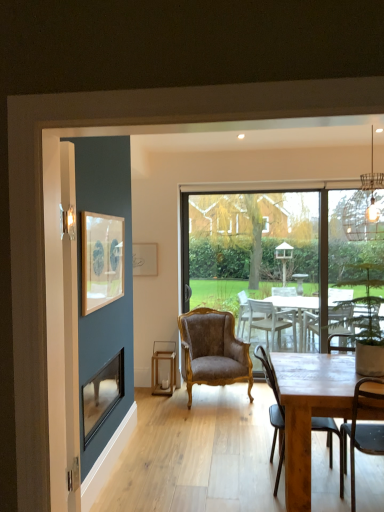
Describe the element at coordinates (212, 351) in the screenshot. The image size is (384, 512). I see `brown velvet armchair at center, which appears as the 1th chair when viewed from the back` at that location.

Image resolution: width=384 pixels, height=512 pixels. In order to click on matte white picture frame at upper center, acting as the 2th picture frame starting from the front in this screenshot , I will do `click(144, 259)`.

Looking at this image, is brown velvet armchair at center, the 3th chair from the front, spatially inside transparent glass window at center, or outside of it?

brown velvet armchair at center, the 3th chair from the front, is not enclosed by transparent glass window at center.

Considering the positions of objects brown velvet armchair at center, which appears as the 1th chair when viewed from the back, and transparent glass window at center in the image provided, who is more to the left, brown velvet armchair at center, which appears as the 1th chair when viewed from the back, or transparent glass window at center?

From the viewer's perspective, brown velvet armchair at center, which appears as the 1th chair when viewed from the back, appears more on the left side.

From the image's perspective, between brown velvet armchair at center, the 3th chair from the front, and transparent glass window at center, who is located below?

brown velvet armchair at center, the 3th chair from the front, appears lower in the image.

Does wooden chair at right, arranged as the 2th chair when viewed from the back, lie behind metallic black chair at lower right, the first chair when ordered from front to back?

That is True.

Does wooden chair at right, marked as the second chair in a front-to-back arrangement, turn towards metallic black chair at lower right, the first chair when ordered from front to back?

Yes, wooden chair at right, marked as the second chair in a front-to-back arrangement, is turned towards metallic black chair at lower right, the first chair when ordered from front to back.

Considering the positions of objects wooden chair at right, marked as the second chair in a front-to-back arrangement, and metallic black chair at lower right, the first chair when ordered from front to back, in the image provided, who is more to the right, wooden chair at right, marked as the second chair in a front-to-back arrangement, or metallic black chair at lower right, the first chair when ordered from front to back,?

Positioned to the right is metallic black chair at lower right, the first chair when ordered from front to back.

How many degrees apart are the facing directions of transparent glass window at center and metallic wire cage at upper right?

93.9 degrees.

I want to click on lamp that appears on the right of transparent glass window at center, so click(x=365, y=208).

From a real-world perspective, is transparent glass window at center positioned under metallic wire cage at upper right based on gravity?

Correct, in the physical world, transparent glass window at center is lower than metallic wire cage at upper right.

Considering the sizes of transparent glass window at center and metallic wire cage at upper right in the image, is transparent glass window at center bigger or smaller than metallic wire cage at upper right?

Considering their sizes, transparent glass window at center takes up more space than metallic wire cage at upper right.

From a real-world perspective, which object rests below the other?

metallic black chair at lower right, the first chair when ordered from front to back.

Who is bigger, metallic black chair at lower right, the 3th chair when ordered from back to front, or wooden framed artwork at upper left, acting as the first picture frame starting from the front?

metallic black chair at lower right, the 3th chair when ordered from back to front.

In the scene shown: Is metallic black chair at lower right, the first chair when ordered from front to back, to the left or to the right of wooden framed artwork at upper left, acting as the first picture frame starting from the front, in the image?

From the image, it's evident that metallic black chair at lower right, the first chair when ordered from front to back, is to the right of wooden framed artwork at upper left, acting as the first picture frame starting from the front.

Considering the sizes of objects wooden chair at right, arranged as the 2th chair when viewed from the back, and matte white picture frame at upper center, which appears as the first picture frame when viewed from the back, in the image provided, who is smaller, wooden chair at right, arranged as the 2th chair when viewed from the back, or matte white picture frame at upper center, which appears as the first picture frame when viewed from the back,?

With smaller size is matte white picture frame at upper center, which appears as the first picture frame when viewed from the back.

How many degrees apart are the facing directions of wooden chair at right, arranged as the 2th chair when viewed from the back, and matte white picture frame at upper center, which appears as the first picture frame when viewed from the back?

87.2 degrees separate the facing orientations of wooden chair at right, arranged as the 2th chair when viewed from the back, and matte white picture frame at upper center, which appears as the first picture frame when viewed from the back.

From the image's perspective, is wooden chair at right, marked as the second chair in a front-to-back arrangement, above or below matte white picture frame at upper center, acting as the 2th picture frame starting from the front?

wooden chair at right, marked as the second chair in a front-to-back arrangement, is below matte white picture frame at upper center, acting as the 2th picture frame starting from the front.

Is wooden chair at right, arranged as the 2th chair when viewed from the back, placed right next to matte white picture frame at upper center, acting as the 2th picture frame starting from the front?

wooden chair at right, arranged as the 2th chair when viewed from the back, is not next to matte white picture frame at upper center, acting as the 2th picture frame starting from the front, and they're not touching.

Considering the relative sizes of transparent glass window at center and wooden chair at right, marked as the second chair in a front-to-back arrangement, in the image provided, is transparent glass window at center thinner than wooden chair at right, marked as the second chair in a front-to-back arrangement,?

Yes.

Is point (256, 234) farther from viewer compared to point (272, 387)?

Yes, point (256, 234) is behind point (272, 387).

Is transparent glass window at center surrounding wooden chair at right, marked as the second chair in a front-to-back arrangement?

No, wooden chair at right, marked as the second chair in a front-to-back arrangement, is not a part of transparent glass window at center.

Is transparent glass window at center looking in the opposite direction of wooden chair at right, arranged as the 2th chair when viewed from the back?

transparent glass window at center does not have its back to wooden chair at right, arranged as the 2th chair when viewed from the back.

Which is more to the left, metallic wire cage at upper right or matte white picture frame at upper center, acting as the 2th picture frame starting from the front?

From the viewer's perspective, matte white picture frame at upper center, acting as the 2th picture frame starting from the front, appears more on the left side.

Does metallic wire cage at upper right turn towards matte white picture frame at upper center, which appears as the first picture frame when viewed from the back?

No, metallic wire cage at upper right is not facing towards matte white picture frame at upper center, which appears as the first picture frame when viewed from the back.

Is matte white picture frame at upper center, acting as the 2th picture frame starting from the front, a part of metallic wire cage at upper right?

No, matte white picture frame at upper center, acting as the 2th picture frame starting from the front, is not inside metallic wire cage at upper right.

Based on their sizes in the image, would you say metallic wire cage at upper right is bigger or smaller than matte white picture frame at upper center, acting as the 2th picture frame starting from the front?

Considering their sizes, metallic wire cage at upper right takes up more space than matte white picture frame at upper center, acting as the 2th picture frame starting from the front.

Locate an element on the screen. the 1st chair in front of the transparent glass window at center is located at coordinates (212, 351).

Locate an element on the screen. This screenshot has width=384, height=512. chair below the wooden chair at right, arranged as the 2th chair when viewed from the back (from the image's perspective) is located at coordinates (361, 431).

When comparing their distances from wooden chair at right, marked as the second chair in a front-to-back arrangement, does wooden framed artwork at upper left, acting as the second picture frame starting from the back, or metallic black chair at lower right, the first chair when ordered from front to back, seem further?

Among the two, wooden framed artwork at upper left, acting as the second picture frame starting from the back, is located further to wooden chair at right, marked as the second chair in a front-to-back arrangement.

Looking at the image, which one is located further to matte white picture frame at upper center, which appears as the first picture frame when viewed from the back, brown velvet armchair at center, the 3th chair from the front, or wooden chair at right, arranged as the 2th chair when viewed from the back?

wooden chair at right, arranged as the 2th chair when viewed from the back.

From the image, which object appears to be nearer to metallic black chair at lower right, the first chair when ordered from front to back, transparent glass window at center or metallic wire cage at upper right?

metallic wire cage at upper right.

Based on their spatial positions, is wooden framed artwork at upper left, acting as the first picture frame starting from the front, or metallic black chair at lower right, the first chair when ordered from front to back, closer to matte white picture frame at upper center, which appears as the first picture frame when viewed from the back?

Based on the image, wooden framed artwork at upper left, acting as the first picture frame starting from the front, appears to be nearer to matte white picture frame at upper center, which appears as the first picture frame when viewed from the back.

Based on their spatial positions, is transparent glass window at center or wooden chair at right, arranged as the 2th chair when viewed from the back, further from metallic black chair at lower right, the first chair when ordered from front to back?

transparent glass window at center is further to metallic black chair at lower right, the first chair when ordered from front to back.

Estimate the real-world distances between objects in this image. Which object is further from matte white picture frame at upper center, acting as the 2th picture frame starting from the front, wooden framed artwork at upper left, acting as the first picture frame starting from the front, or transparent glass window at center?

wooden framed artwork at upper left, acting as the first picture frame starting from the front, is positioned further to the anchor matte white picture frame at upper center, acting as the 2th picture frame starting from the front.

Based on their spatial positions, is wooden chair at right, arranged as the 2th chair when viewed from the back, or matte white picture frame at upper center, which appears as the first picture frame when viewed from the back, further from transparent glass window at center?

wooden chair at right, arranged as the 2th chair when viewed from the back.

Estimate the real-world distances between objects in this image. Which object is further from brown velvet armchair at center, the 3th chair from the front, metallic wire cage at upper right or wooden framed artwork at upper left, acting as the first picture frame starting from the front?

metallic wire cage at upper right.

This screenshot has width=384, height=512. Find the location of `lamp between wooden framed artwork at upper left, acting as the second picture frame starting from the back, and matte white picture frame at upper center, acting as the 2th picture frame starting from the front, along the z-axis`. lamp between wooden framed artwork at upper left, acting as the second picture frame starting from the back, and matte white picture frame at upper center, acting as the 2th picture frame starting from the front, along the z-axis is located at coordinates (365, 208).

Where is `picture frame positioned between metallic black chair at lower right, the 3th chair when ordered from back to front, and matte white picture frame at upper center, acting as the 2th picture frame starting from the front, from near to far`? The height and width of the screenshot is (512, 384). picture frame positioned between metallic black chair at lower right, the 3th chair when ordered from back to front, and matte white picture frame at upper center, acting as the 2th picture frame starting from the front, from near to far is located at coordinates (101, 260).

Find the location of a particular element. This screenshot has width=384, height=512. chair between wooden framed artwork at upper left, acting as the first picture frame starting from the front, and brown velvet armchair at center, which appears as the 1th chair when viewed from the back, from front to back is located at coordinates point(273,412).

Where is `picture frame between metallic black chair at lower right, the first chair when ordered from front to back, and brown velvet armchair at center, which appears as the 1th chair when viewed from the back, along the z-axis`? The height and width of the screenshot is (512, 384). picture frame between metallic black chair at lower right, the first chair when ordered from front to back, and brown velvet armchair at center, which appears as the 1th chair when viewed from the back, along the z-axis is located at coordinates pos(101,260).